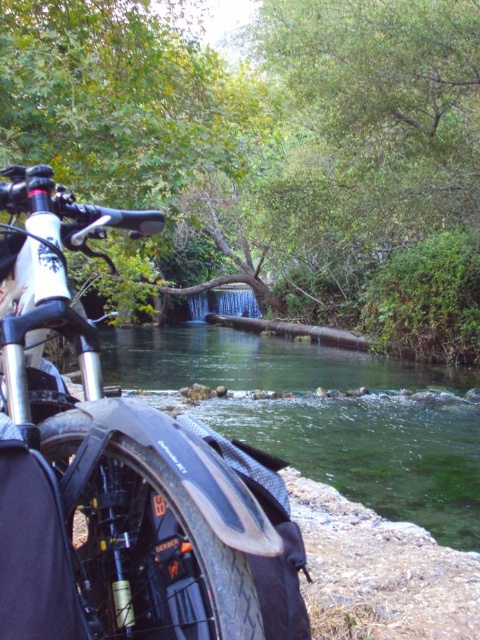
Between shiny metallic bicycle at left and clear water at center, which one is positioned higher?

shiny metallic bicycle at left

Find the location of a particular element. shiny metallic bicycle at left is located at coordinates (x=105, y=465).